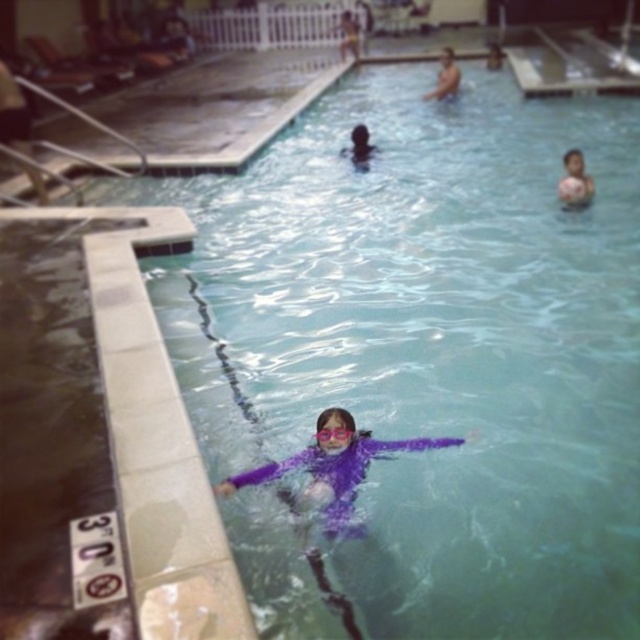
Question: Which point is farther to the camera?

Choices:
 (A) purple rubber at upper right
 (B) smooth skin person at upper center

Answer: (B)

Question: Is purple rubberized swimsuit at center positioned before purple rubber at upper right?

Choices:
 (A) yes
 (B) no

Answer: (A)

Question: Among these objects, which one is nearest to the camera?

Choices:
 (A) smooth skin person at upper center
 (B) smooth skin head at upper center
 (C) purple plastic goggles at center
 (D) purple rubber at upper right

Answer: (C)

Question: Which is farther from the purple plastic goggles at center?

Choices:
 (A) smooth skin head at upper center
 (B) smooth skin person at upper center

Answer: (B)

Question: Can you confirm if smooth skin head at upper center is thinner than purple plastic goggles at center?

Choices:
 (A) no
 (B) yes

Answer: (A)

Question: In this image, where is purple rubberized swimsuit at center located relative to purple plastic goggles at center?

Choices:
 (A) left
 (B) right

Answer: (B)